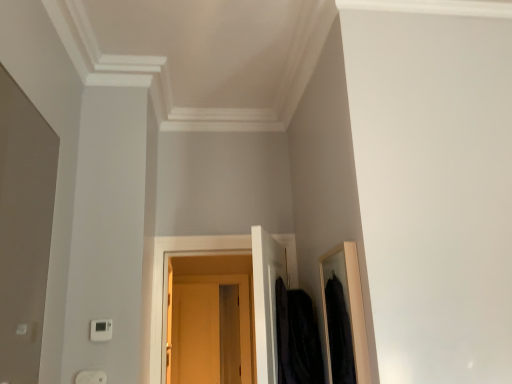
Question: From a real-world perspective, is white plastic electric outlet at lower left physically above white plastic thermostat at lower left?

Choices:
 (A) no
 (B) yes

Answer: (A)

Question: From the image's perspective, is white plastic electric outlet at lower left on white plastic thermostat at lower left?

Choices:
 (A) yes
 (B) no

Answer: (B)

Question: Is white plastic electric outlet at lower left at the left side of white plastic thermostat at lower left?

Choices:
 (A) no
 (B) yes

Answer: (B)

Question: From a real-world perspective, is white plastic electric outlet at lower left beneath white plastic thermostat at lower left?

Choices:
 (A) yes
 (B) no

Answer: (A)

Question: Is white plastic electric outlet at lower left far from white plastic thermostat at lower left?

Choices:
 (A) yes
 (B) no

Answer: (B)

Question: From a real-world perspective, is white plastic electric outlet at lower left positioned above or below velvet black coat at right?

Choices:
 (A) below
 (B) above

Answer: (A)

Question: Is white plastic electric outlet at lower left inside the boundaries of velvet black coat at right, or outside?

Choices:
 (A) outside
 (B) inside

Answer: (A)

Question: In terms of width, does white plastic electric outlet at lower left look wider or thinner when compared to velvet black coat at right?

Choices:
 (A) thin
 (B) wide

Answer: (A)

Question: In terms of height, does white plastic electric outlet at lower left look taller or shorter compared to velvet black coat at right?

Choices:
 (A) tall
 (B) short

Answer: (B)

Question: Does point (96, 372) appear closer or farther from the camera than point (99, 332)?

Choices:
 (A) closer
 (B) farther

Answer: (A)

Question: From a real-world perspective, is white plastic electric outlet at lower left physically located above or below white plastic thermostat at lower left?

Choices:
 (A) below
 (B) above

Answer: (A)

Question: Based on their positions, is white plastic electric outlet at lower left located to the left or right of white plastic thermostat at lower left?

Choices:
 (A) right
 (B) left

Answer: (B)

Question: Considering the positions of white plastic electric outlet at lower left and white plastic thermostat at lower left in the image, is white plastic electric outlet at lower left taller or shorter than white plastic thermostat at lower left?

Choices:
 (A) tall
 (B) short

Answer: (B)

Question: Do you think matte wood door at center is within white plastic thermostat at lower left, or outside of it?

Choices:
 (A) outside
 (B) inside

Answer: (A)

Question: Considering the relative positions of matte wood door at center and white plastic thermostat at lower left in the image provided, is matte wood door at center to the left or to the right of white plastic thermostat at lower left?

Choices:
 (A) right
 (B) left

Answer: (A)